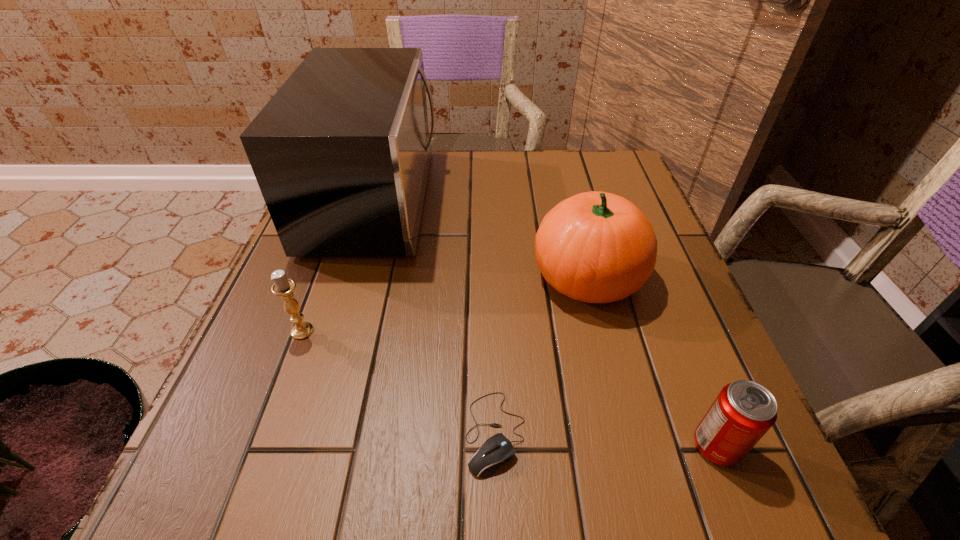
You are a GUI agent. You are given a task and a screenshot of the screen. Output one action in this format:
    pyautogui.click(x=<x>, y=<y>)
    Task: Click on the unoccupied position between the candle holder and the soda can
    The width and height of the screenshot is (960, 540).
    Given the screenshot: What is the action you would take?
    pyautogui.click(x=510, y=388)

This screenshot has height=540, width=960. Identify the location of vacant space that is in between the microwave oven and the soda can. (546, 322).

The height and width of the screenshot is (540, 960). I want to click on unoccupied position between the candle holder and the pumpkin, so click(x=445, y=303).

Where is `free space between the soda can and the microwave oven`? The width and height of the screenshot is (960, 540). free space between the soda can and the microwave oven is located at coordinates (546, 322).

Locate an element on the screen. The image size is (960, 540). free spot between the candle holder and the pumpkin is located at coordinates (445, 303).

At what (x,y) coordinates should I click in order to perform the action: click on vacant area that lies between the computer mouse and the microwave oven. Please return your answer as a coordinate pair (x, y). Looking at the image, I should click on (436, 315).

The width and height of the screenshot is (960, 540). Find the location of `object that is the second nearest to the microwave oven`. object that is the second nearest to the microwave oven is located at coordinates coord(596,247).

Locate an element on the screen. This screenshot has width=960, height=540. the closest object to the microwave oven is located at coordinates (283, 286).

You are a GUI agent. You are given a task and a screenshot of the screen. Output one action in this format:
    pyautogui.click(x=<x>, y=<y>)
    Task: Click on the free space that satisfies the following two spatial constraints: 1. with the door open on the tallest object; 2. on the back side of the soda can
    The width and height of the screenshot is (960, 540).
    Given the screenshot: What is the action you would take?
    pyautogui.click(x=301, y=446)

Locate an element on the screen. Image resolution: width=960 pixels, height=540 pixels. free space that satisfies the following two spatial constraints: 1. with the door open on the tallest object; 2. on the right side of the pumpkin is located at coordinates point(352,276).